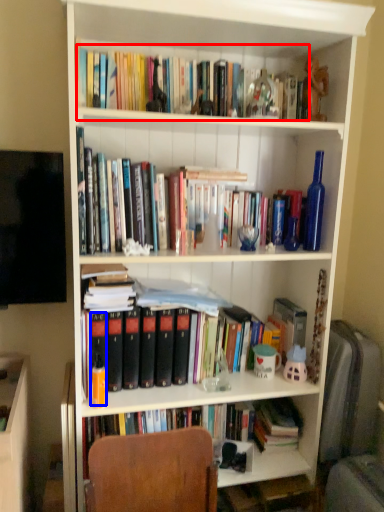
Question: Which of the following is the closest to the observer, book (highlighted by a red box) or paperback book (highlighted by a blue box)?

Choices:
 (A) book
 (B) paperback book

Answer: (A)